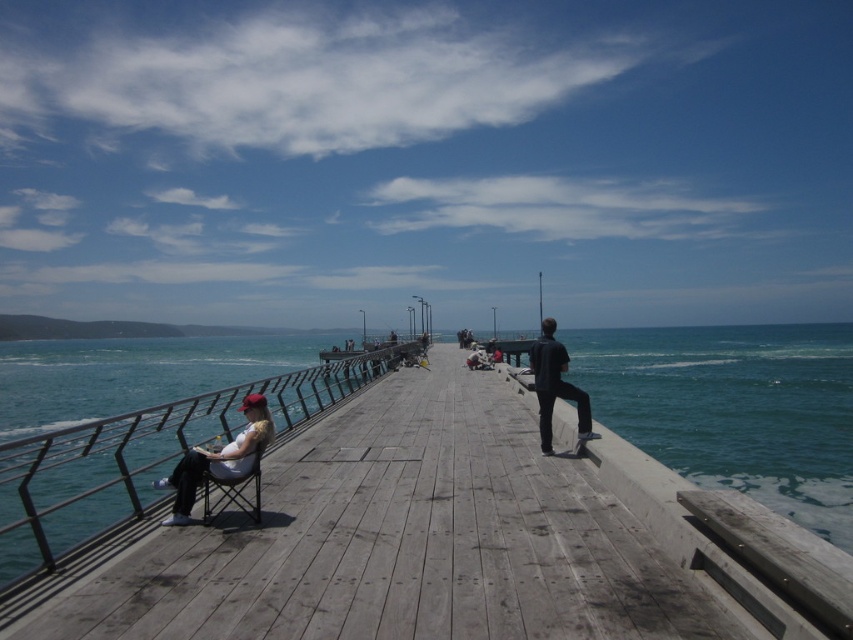
You are standing at the edge of the wooden pier and want to place a 3.0 meter long wooden bench on the weathered wood dock at center. Can the bench fit on the dock?

The weathered wood dock at center and viewer are 3.12 meters apart. Since the bench is 3.0 meters long, it can fit on the dock as the distance between the viewer and the dock is slightly larger than the bench length.

You are standing on the wooden pier and want to place a small potted plant between the metallic silver rail at left and the dark blue fabric pants at center. Which object should you place it closer to if you want the plant to be near the larger object?

You should place the small potted plant closer to the metallic silver rail at left because it is larger than the dark blue fabric pants at center.